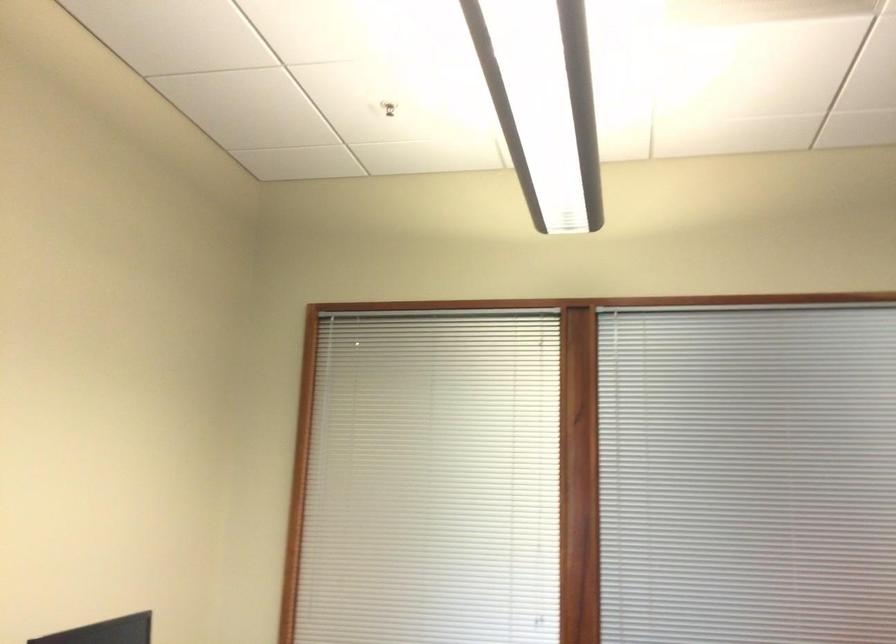
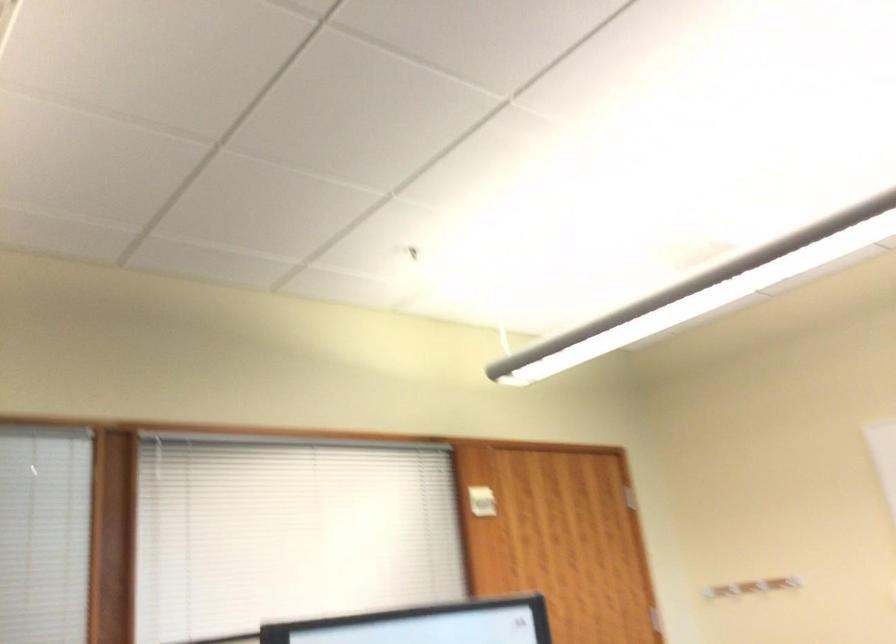
Question: How did the camera likely rotate?

Choices:
 (A) Left
 (B) Right
 (C) Up
 (D) Down

Answer: (B)